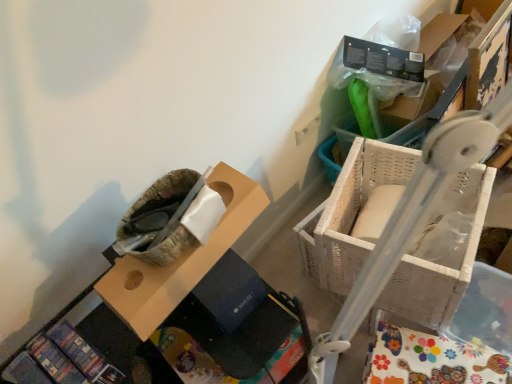
Describe the element at coordinates (353, 212) in the screenshot. I see `white wicker basket at lower right` at that location.

At what (x,y) coordinates should I click in order to perform the action: click on white wicker basket at lower right. Please return your answer as a coordinate pair (x, y). This screenshot has width=512, height=384. Looking at the image, I should click on (353, 212).

You are a GUI agent. You are given a task and a screenshot of the screen. Output one action in this format:
    pyautogui.click(x=<x>, y=<y>)
    Task: Click on the white wicker basket at lower right
    This screenshot has width=512, height=384.
    Given the screenshot: What is the action you would take?
    pyautogui.click(x=353, y=212)